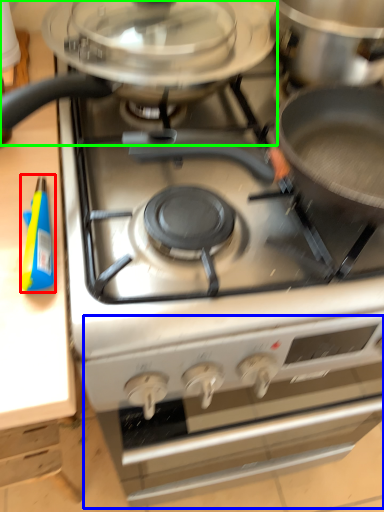
Question: Considering the real-world distances, which object is closest to appliance (highlighted by a red box)? oven (highlighted by a blue box) or kitchen appliance (highlighted by a green box).

Choices:
 (A) oven
 (B) kitchen appliance

Answer: (B)